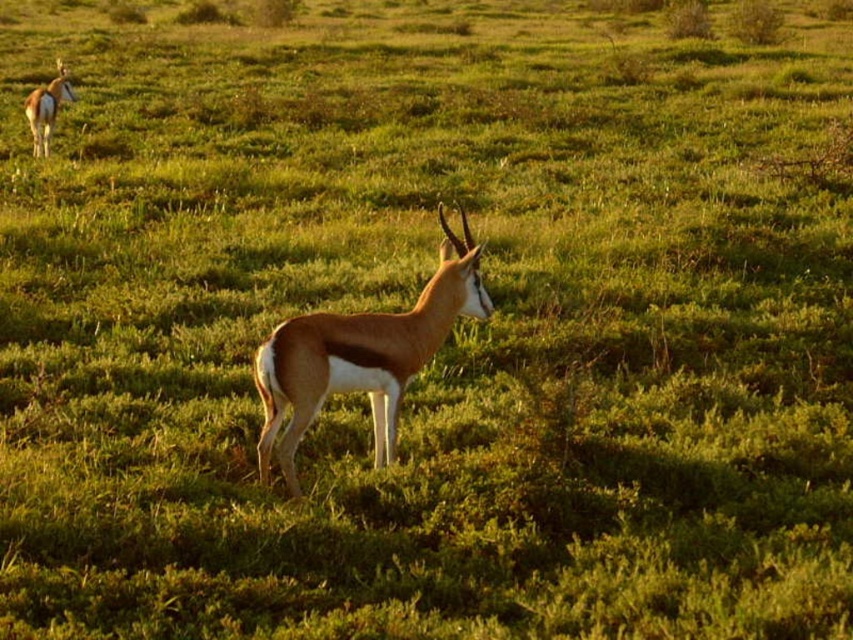
You are a wildlife photographer trying to capture a photo of the brown glossy antelope at center. Your camera has a zoom lens that can focus precisely on coordinates up to 0.5 units away from the center point. The antelope is located at coordinates point 0.555, 0.426. Can you successfully focus on the antelope with your current settings?

The brown glossy antelope at center is located at coordinates point (363, 355). Since the camera can focus up to 0.5 units away from the center, the distance from the center to the antelope must be calculated. The distance is sqrt??

You are a wildlife researcher observing the brown glossy antelope at center and the brown glossy antelope at upper left in the savanna. Which antelope is taller?

The brown glossy antelope at center is taller than the brown glossy antelope at upper left.

You are a wildlife photographer aiming to capture a closeup shot of the brown glossy antelope at center and the brown glossy antelope at upper left. Given that your camera can only focus on one antelope at a time, which one should you choose to ensure the photo is sharp and clear?

You should choose the brown glossy antelope at center because it is closer to the photographer and its larger width makes it easier to focus on compared to the smaller and more distant brown glossy antelope at upper left.